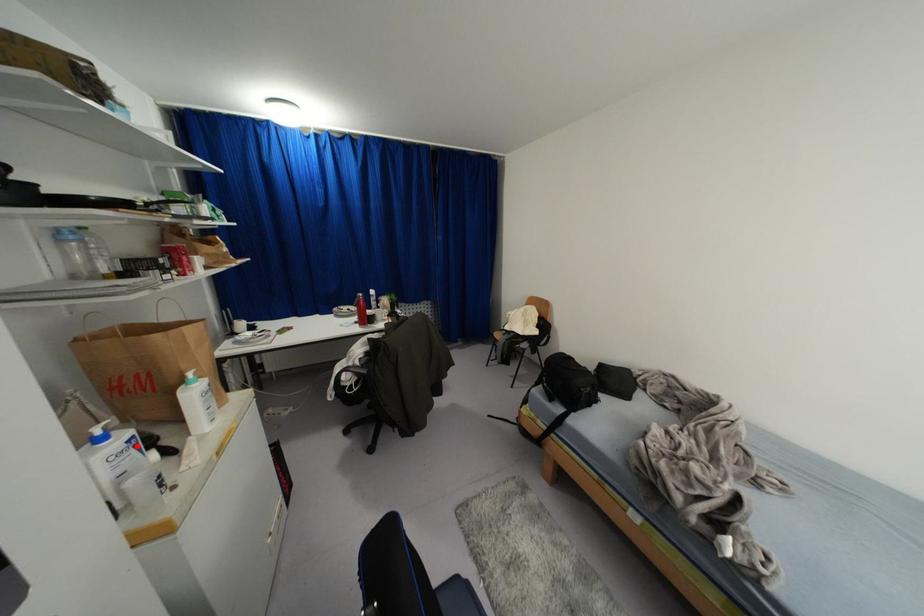
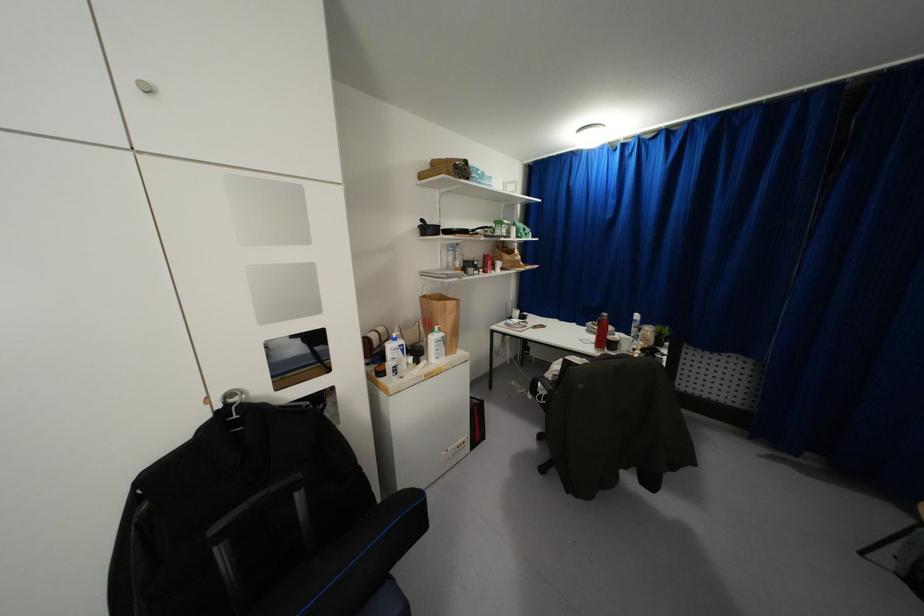
In the second image, find the point that corresponds to the highlighted location in the first image.

(402, 350)